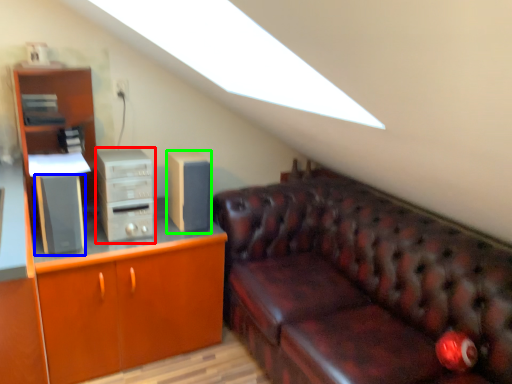
Question: Estimate the real-world distances between objects in this image. Which object is closer to computer tower (highlighted by a red box), speaker (highlighted by a blue box) or speaker (highlighted by a green box)?

Choices:
 (A) speaker
 (B) speaker

Answer: (A)